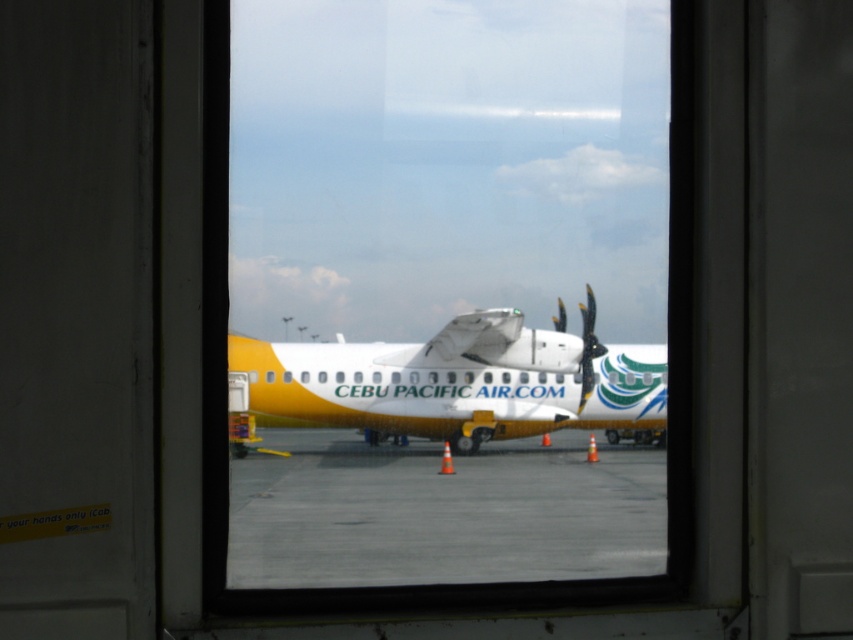
Question: Observing the image, what is the correct spatial positioning of yellow matte airplane at center in reference to polished metallic propeller at right?

Choices:
 (A) right
 (B) left

Answer: (B)

Question: Observing the image, what is the correct spatial positioning of concrete tarmac at center in reference to polished metallic propeller at right?

Choices:
 (A) above
 (B) below

Answer: (B)

Question: Considering the real-world distances, which object is farthest from the concrete tarmac at center?

Choices:
 (A) polished metallic propeller at right
 (B) transparent glass airplane at center

Answer: (A)

Question: Can you confirm if transparent glass airplane at center is thinner than concrete tarmac at center?

Choices:
 (A) yes
 (B) no

Answer: (B)

Question: Based on their relative distances, which object is farther from the transparent glass airplane at center?

Choices:
 (A) concrete tarmac at center
 (B) polished metallic propeller at right
 (C) yellow matte airplane at center

Answer: (B)

Question: Among these points, which one is farthest from the camera?

Choices:
 (A) (241, 371)
 (B) (592, 380)
 (C) (300, 552)

Answer: (B)